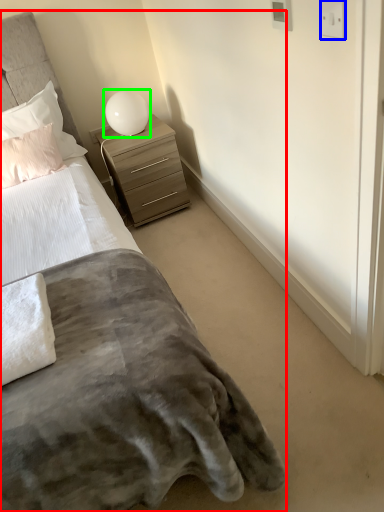
Question: Which object is the farthest from bed (highlighted by a red box)? Choose among these: electric outlet (highlighted by a blue box) or table lamp (highlighted by a green box).

Choices:
 (A) electric outlet
 (B) table lamp

Answer: (B)